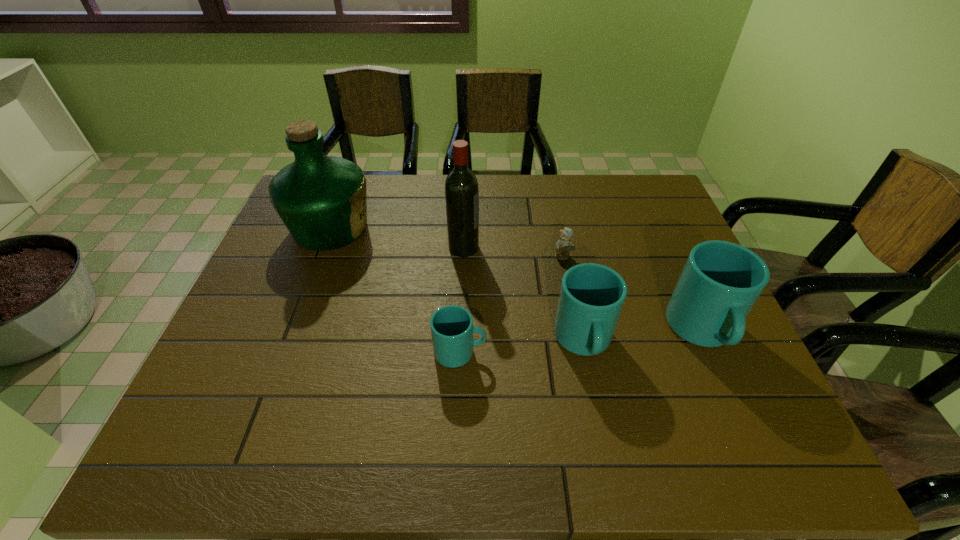
The width and height of the screenshot is (960, 540). In the image, there is a desktop. Identify the location of vacant area at the near edge. coord(577,403).

Find the location of a particular element. This screenshot has width=960, height=540. free space at the left edge is located at coordinates (282, 238).

You are a GUI agent. You are given a task and a screenshot of the screen. Output one action in this format:
    pyautogui.click(x=<x>, y=<y>)
    Task: Click on the vacant area at the right edge of the desktop
    
    Given the screenshot: What is the action you would take?
    pyautogui.click(x=677, y=260)

Where is `vacant space at the far right corner`? vacant space at the far right corner is located at coordinates (610, 186).

Identify the location of free space between the liquor and the fourth tallest object. (457, 285).

The width and height of the screenshot is (960, 540). I want to click on free space between the liquor and the second cup from right to left, so point(457,285).

Where is `free point between the shortest object and the wine bottle`? free point between the shortest object and the wine bottle is located at coordinates (514, 252).

Where is `free space between the shortest cup and the wine bottle`? The width and height of the screenshot is (960, 540). free space between the shortest cup and the wine bottle is located at coordinates (462, 300).

Where is `empty location between the rightmost object and the liquor`? empty location between the rightmost object and the liquor is located at coordinates (516, 280).

Locate an element on the screen. empty space that is in between the shortest object and the leftmost object is located at coordinates (447, 242).